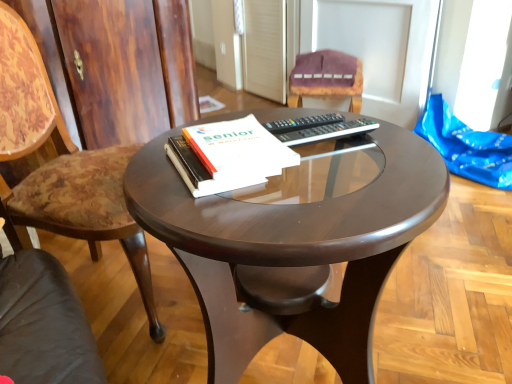
Question: Is black plastic remote at center in front of or behind wooden chair at left, which is the 2th chair in back-to-front order, in the image?

Choices:
 (A) front
 (B) behind

Answer: (B)

Question: From the image's perspective, is black plastic remote at center above or below wooden chair at left, which is the second chair from right to left?

Choices:
 (A) below
 (B) above

Answer: (B)

Question: Estimate the real-world distances between objects in this image. Which object is closer to the velvet purple chair at upper center, which is the 2th chair from front to back?

Choices:
 (A) black plastic remote at center
 (B) glossy wood coffee table at center
 (C) wooden chair at left, positioned as the first chair in left-to-right order
 (D) white paper at center

Answer: (C)

Question: Which of these objects is positioned farthest from the white paper at center?

Choices:
 (A) black plastic remote at center
 (B) velvet purple chair at upper center, arranged as the 1th chair when viewed from the back
 (C) glossy wood coffee table at center
 (D) wooden chair at left, which is the 2th chair in back-to-front order

Answer: (B)